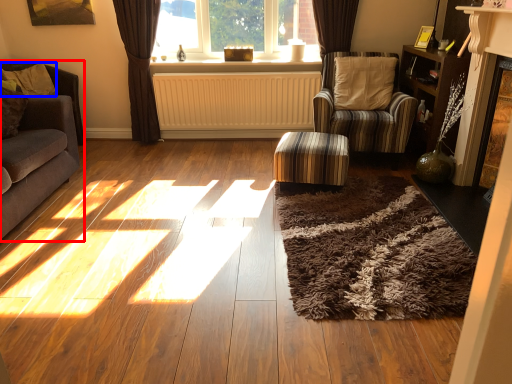
Question: Among these objects, which one is farthest to the camera, studio couch (highlighted by a red box) or pillow (highlighted by a blue box)?

Choices:
 (A) studio couch
 (B) pillow

Answer: (B)